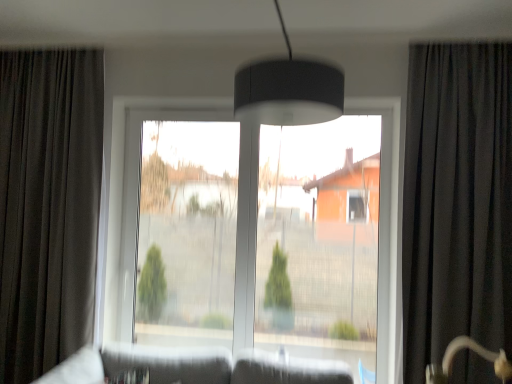
Question: From a real-world perspective, does transparent glass window screen at center sit lower than black velvet curtain at right, marked as the second curtain in a left-to-right arrangement?

Choices:
 (A) yes
 (B) no

Answer: (A)

Question: Is transparent glass window screen at center further to camera compared to black velvet curtain at right, marked as the second curtain in a left-to-right arrangement?

Choices:
 (A) yes
 (B) no

Answer: (A)

Question: Can you confirm if transparent glass window screen at center is smaller than black velvet curtain at right, which is the 1th curtain from right to left?

Choices:
 (A) no
 (B) yes

Answer: (B)

Question: Considering the relative sizes of transparent glass window screen at center and black velvet curtain at right, which is the 1th curtain from right to left, in the image provided, is transparent glass window screen at center taller than black velvet curtain at right, which is the 1th curtain from right to left,?

Choices:
 (A) yes
 (B) no

Answer: (B)

Question: Is transparent glass window screen at center turned away from black velvet curtain at right, marked as the second curtain in a left-to-right arrangement?

Choices:
 (A) no
 (B) yes

Answer: (A)

Question: Is transparent glass window screen at center thinner than black velvet curtain at right, marked as the second curtain in a left-to-right arrangement?

Choices:
 (A) yes
 (B) no

Answer: (A)

Question: From the image's perspective, is black velvet curtain at right, which is the 1th curtain from right to left, over dark grey fabric curtain at left, the 2th curtain from the right?

Choices:
 (A) no
 (B) yes

Answer: (B)

Question: Does black velvet curtain at right, which is the 1th curtain from right to left, have a greater height compared to dark grey fabric curtain at left, acting as the first curtain starting from the left?

Choices:
 (A) yes
 (B) no

Answer: (B)

Question: Can you confirm if black velvet curtain at right, which is the 1th curtain from right to left, is shorter than dark grey fabric curtain at left, acting as the first curtain starting from the left?

Choices:
 (A) no
 (B) yes

Answer: (B)

Question: Is black velvet curtain at right, marked as the second curtain in a left-to-right arrangement, looking in the opposite direction of dark grey fabric curtain at left, acting as the first curtain starting from the left?

Choices:
 (A) no
 (B) yes

Answer: (A)

Question: Does black velvet curtain at right, marked as the second curtain in a left-to-right arrangement, have a smaller size compared to dark grey fabric curtain at left, the 2th curtain from the right?

Choices:
 (A) yes
 (B) no

Answer: (B)

Question: From a real-world perspective, is black velvet curtain at right, marked as the second curtain in a left-to-right arrangement, positioned over dark grey fabric curtain at left, the 2th curtain from the right, based on gravity?

Choices:
 (A) yes
 (B) no

Answer: (A)

Question: Is transparent glass window at center smaller than transparent glass window screen at center?

Choices:
 (A) yes
 (B) no

Answer: (B)